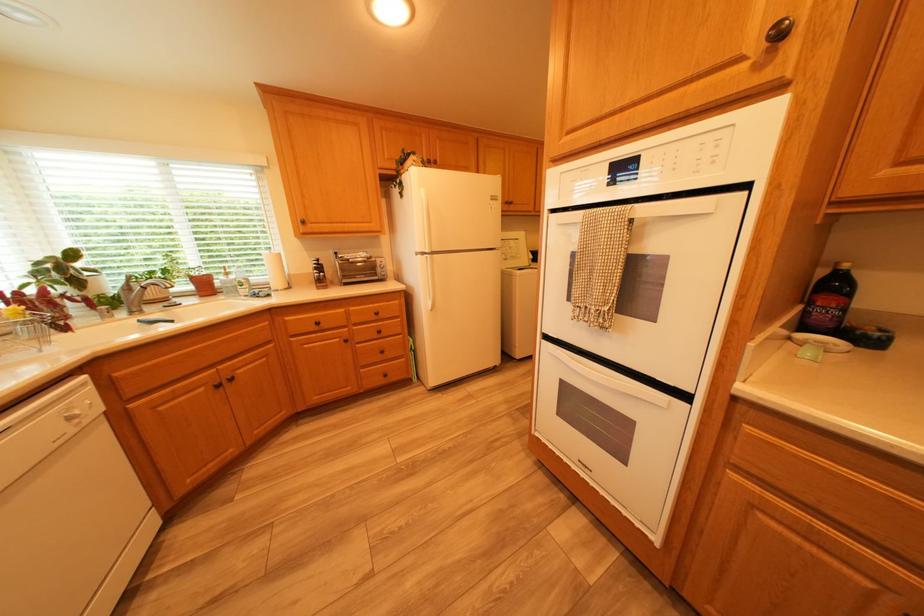
Where is `soap dispenser pump`? Image resolution: width=924 pixels, height=616 pixels. soap dispenser pump is located at coordinates (319, 274).